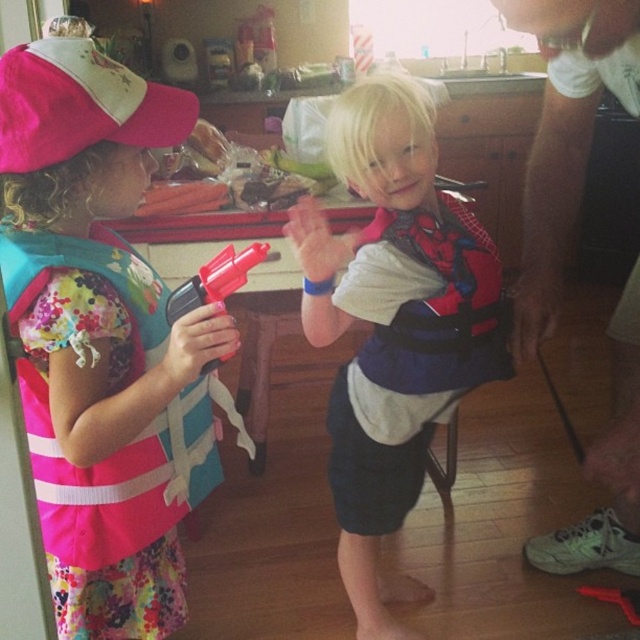
Who is taller, spiderman-patterned life vest at center or pink fabric backpack at center?

With more height is spiderman-patterned life vest at center.

Can you confirm if spiderman-patterned life vest at center is taller than pink fabric backpack at center?

Yes, spiderman-patterned life vest at center is taller than pink fabric backpack at center.

Which is in front, point (323, 275) or point (573, 20)?

Point (573, 20) is in front.

Where is `spiderman-patterned life vest at center`? Image resolution: width=640 pixels, height=640 pixels. spiderman-patterned life vest at center is located at coordinates 392,324.

Is pink fabric backpack at left positioned in front of spiderman-patterned life vest at center?

Yes, it is.

Does pink fabric backpack at left appear under spiderman-patterned life vest at center?

No, pink fabric backpack at left is not below spiderman-patterned life vest at center.

What do you see at coordinates (102, 339) in the screenshot? I see `pink fabric backpack at left` at bounding box center [102, 339].

Find the location of a particular element. pink fabric backpack at left is located at coordinates (102, 339).

Is pink fabric backpack at left to the left of pink fabric backpack at center from the viewer's perspective?

Indeed, pink fabric backpack at left is positioned on the left side of pink fabric backpack at center.

Measure the distance from pink fabric backpack at left to pink fabric backpack at center.

They are 34.12 inches apart.

What are the coordinates of `pink fabric backpack at left` in the screenshot? It's located at (102, 339).

At what (x,y) coordinates should I click in order to perform the action: click on pink fabric backpack at left. Please return your answer as a coordinate pair (x, y). This screenshot has height=640, width=640. Looking at the image, I should click on (102, 339).